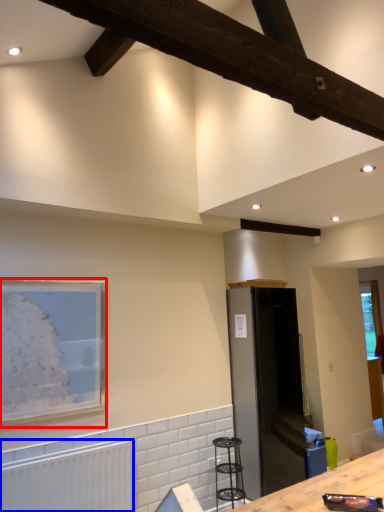
Question: Which object appears closest to the camera in this image, picture frame (highlighted by a red box) or radiator (highlighted by a blue box)?

Choices:
 (A) picture frame
 (B) radiator

Answer: (B)